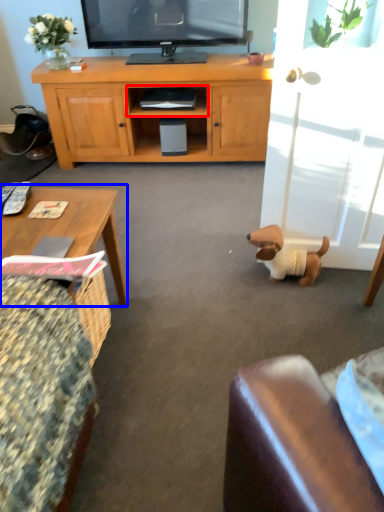
Question: Which point is further to the camera, shelf (highlighted by a red box) or coffee table (highlighted by a blue box)?

Choices:
 (A) shelf
 (B) coffee table

Answer: (A)